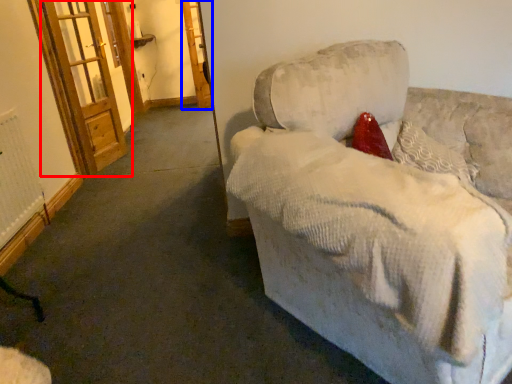
Question: Which point is further to the camera, screen door (highlighted by a red box) or screen door (highlighted by a blue box)?

Choices:
 (A) screen door
 (B) screen door

Answer: (B)